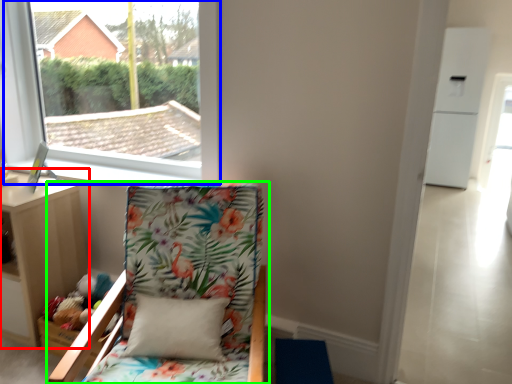
Question: Based on their relative distances, which object is nearer to nightstand (highlighted by a red box)? Choose from window (highlighted by a blue box) and chair (highlighted by a green box).

Choices:
 (A) window
 (B) chair

Answer: (B)